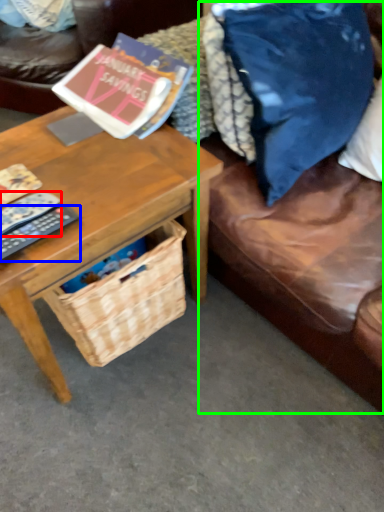
Question: Estimate the real-world distances between objects in this image. Which object is farther from remote control (highlighted by a red box), remote control (highlighted by a blue box) or couch (highlighted by a green box)?

Choices:
 (A) remote control
 (B) couch

Answer: (B)